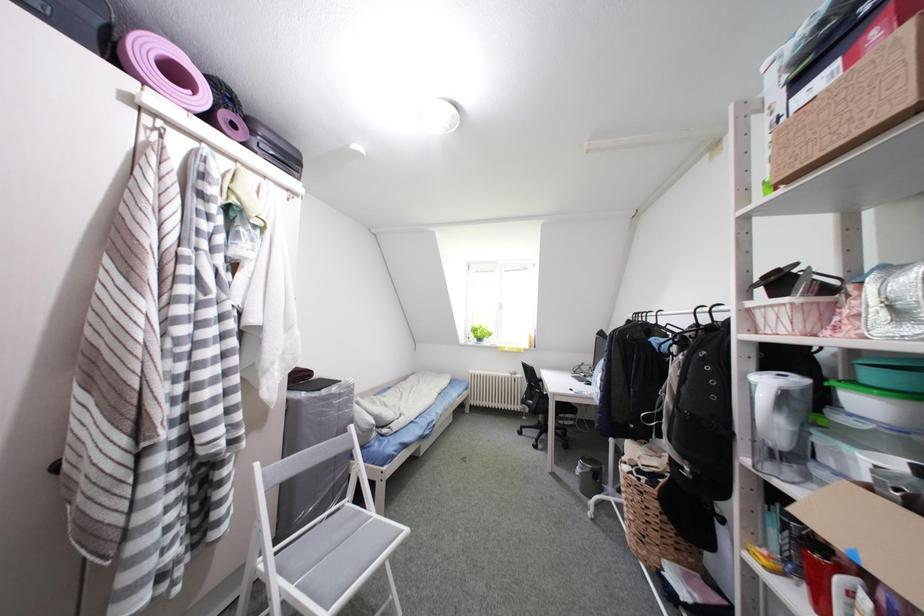
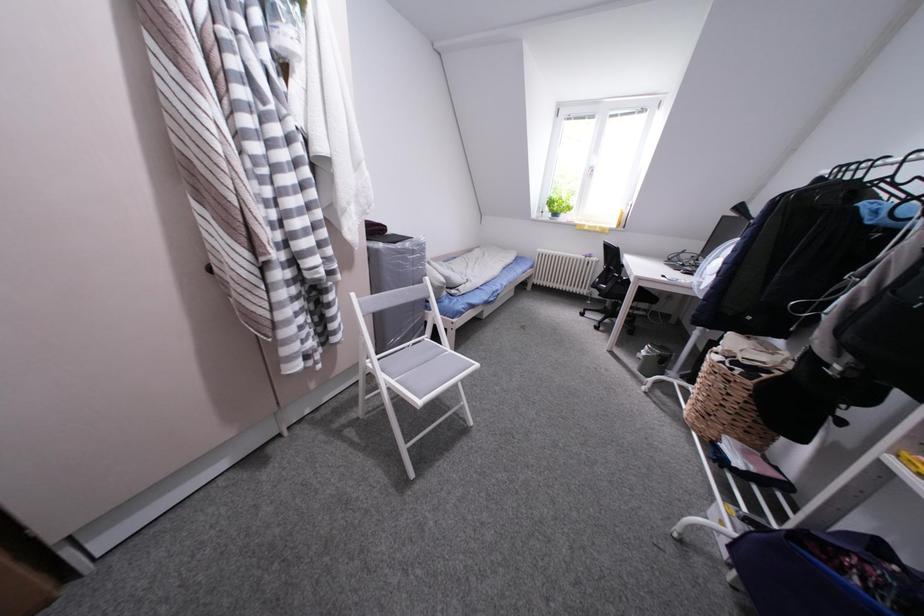
Question: How did the camera likely rotate?

Choices:
 (A) Left
 (B) Right
 (C) Up
 (D) Down

Answer: (D)